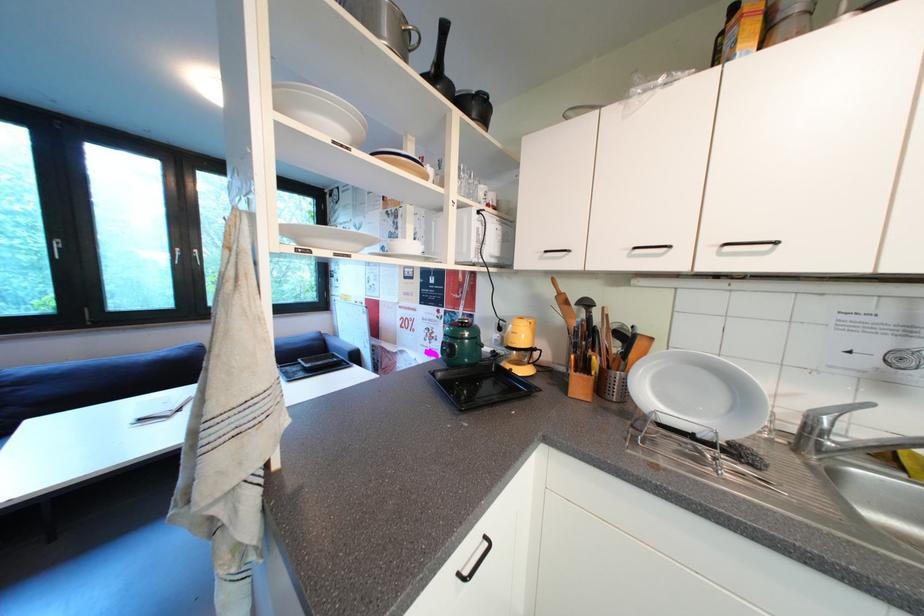
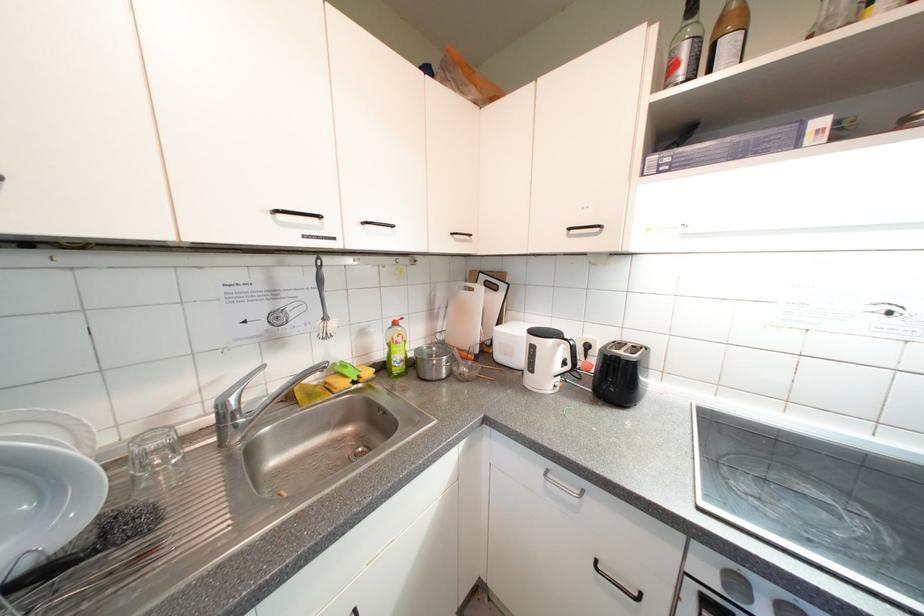
Where in the second image is the point corresponding to (821,431) from the first image?

(233, 419)